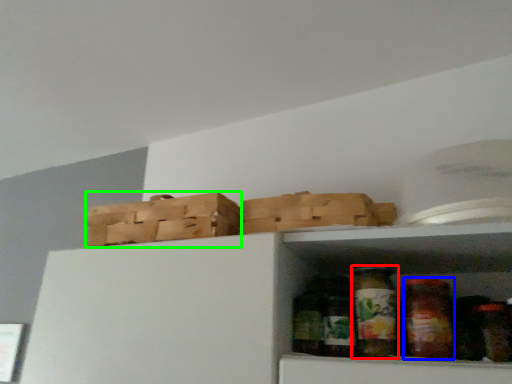
Question: Which object is the closest to the glass jar (highlighted by a red box)? Choose among these: glass jar (highlighted by a blue box) or basket (highlighted by a green box).

Choices:
 (A) glass jar
 (B) basket

Answer: (A)